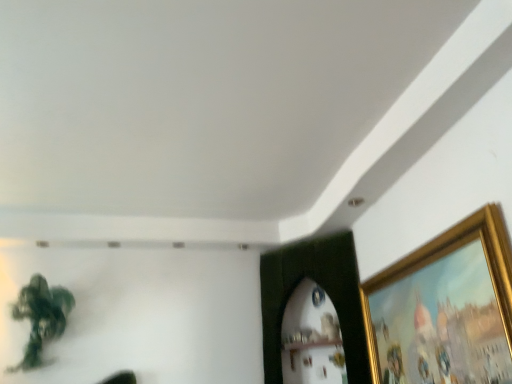
You are a GUI agent. You are given a task and a screenshot of the screen. Output one action in this format:
    pyautogui.click(x=<x>, y=<y>)
    Task: Click on the green matte plant at upper left
    This screenshot has width=512, height=384.
    Given the screenshot: What is the action you would take?
    pyautogui.click(x=41, y=317)

Describe the element at coordinates (41, 317) in the screenshot. I see `green matte plant at upper left` at that location.

What is the approximate width of green matte plant at upper left?

green matte plant at upper left is 21.98 centimeters wide.

Find the location of a particular element. gold metallic picture frame at upper right is located at coordinates (447, 307).

This screenshot has height=384, width=512. Describe the element at coordinates (447, 307) in the screenshot. I see `gold metallic picture frame at upper right` at that location.

What is the approximate height of gold metallic picture frame at upper right?

It is 19.39 inches.

Identify the location of green matte plant at upper left. The width and height of the screenshot is (512, 384). (41, 317).

Considering the relative positions of gold metallic picture frame at upper right and green matte plant at upper left in the image provided, is gold metallic picture frame at upper right to the left of green matte plant at upper left from the viewer's perspective?

In fact, gold metallic picture frame at upper right is to the right of green matte plant at upper left.

From the picture: Does gold metallic picture frame at upper right lie in front of green matte plant at upper left?

Yes, gold metallic picture frame at upper right is in front of green matte plant at upper left.

Which is more distant, (451,349) or (45,313)?

The point (45,313) is behind.

From the image's perspective, relative to green matte plant at upper left, is gold metallic picture frame at upper right above or below?

From the image's perspective, gold metallic picture frame at upper right appears above green matte plant at upper left.

From a real-world perspective, which object rests below the other?

gold metallic picture frame at upper right.

Can you confirm if gold metallic picture frame at upper right is thinner than green matte plant at upper left?

Yes.

Which of these two, gold metallic picture frame at upper right or green matte plant at upper left, stands shorter?

gold metallic picture frame at upper right is shorter.

Does gold metallic picture frame at upper right have a smaller size compared to green matte plant at upper left?

Correct, gold metallic picture frame at upper right occupies less space than green matte plant at upper left.

Is green matte plant at upper left inside gold metallic picture frame at upper right?

No, green matte plant at upper left is not a part of gold metallic picture frame at upper right.

Would you consider gold metallic picture frame at upper right to be distant from green matte plant at upper left?

That's right, there is a large distance between gold metallic picture frame at upper right and green matte plant at upper left.

Is gold metallic picture frame at upper right looking in the opposite direction of green matte plant at upper left?

No.

I want to click on plant below the gold metallic picture frame at upper right (from the image's perspective), so click(x=41, y=317).

Can you confirm if green matte plant at upper left is positioned to the left of gold metallic picture frame at upper right?

Yes, green matte plant at upper left is to the left of gold metallic picture frame at upper right.

Which object is closer to the camera taking this photo, green matte plant at upper left or gold metallic picture frame at upper right?

gold metallic picture frame at upper right is more forward.

Is point (39, 293) farther from camera compared to point (428, 249)?

Yes, point (39, 293) is farther from viewer.

Based on the photo, from the image's perspective, does green matte plant at upper left appear lower than gold metallic picture frame at upper right?

Yes, from the image's perspective, green matte plant at upper left is below gold metallic picture frame at upper right.

Consider the image. From a real-world perspective, is green matte plant at upper left on gold metallic picture frame at upper right?

Indeed, from a real-world perspective, green matte plant at upper left stands above gold metallic picture frame at upper right.

Which object is wider, green matte plant at upper left or gold metallic picture frame at upper right?

Wider between the two is green matte plant at upper left.

Can you confirm if green matte plant at upper left is shorter than gold metallic picture frame at upper right?

Incorrect, the height of green matte plant at upper left does not fall short of that of gold metallic picture frame at upper right.

Between green matte plant at upper left and gold metallic picture frame at upper right, which one has smaller size?

gold metallic picture frame at upper right is smaller.

Is green matte plant at upper left inside the boundaries of gold metallic picture frame at upper right, or outside?

green matte plant at upper left is spatially situated outside gold metallic picture frame at upper right.

Is green matte plant at upper left next to gold metallic picture frame at upper right and touching it?

No, green matte plant at upper left is not making contact with gold metallic picture frame at upper right.

Is green matte plant at upper left oriented towards gold metallic picture frame at upper right?

No, green matte plant at upper left does not turn towards gold metallic picture frame at upper right.

How different are the orientations of green matte plant at upper left and gold metallic picture frame at upper right in degrees?

89.7 degrees separate the facing orientations of green matte plant at upper left and gold metallic picture frame at upper right.

Locate an element on the screen. plant below the gold metallic picture frame at upper right (from the image's perspective) is located at coordinates (41, 317).

The height and width of the screenshot is (384, 512). I want to click on plant behind the gold metallic picture frame at upper right, so click(x=41, y=317).

Locate an element on the screen. Image resolution: width=512 pixels, height=384 pixels. picture frame above the green matte plant at upper left (from the image's perspective) is located at coordinates (447, 307).